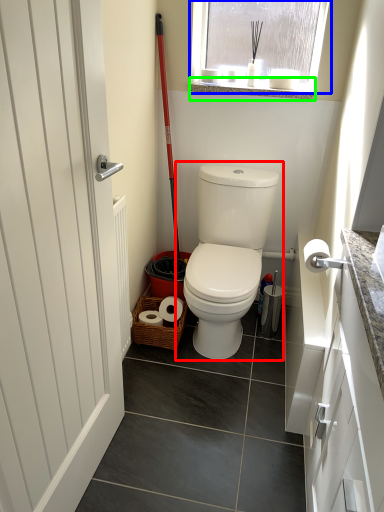
Question: Which is farther away from toilet (highlighted by a red box)? window (highlighted by a blue box) or window sill (highlighted by a green box)?

Choices:
 (A) window
 (B) window sill

Answer: (B)